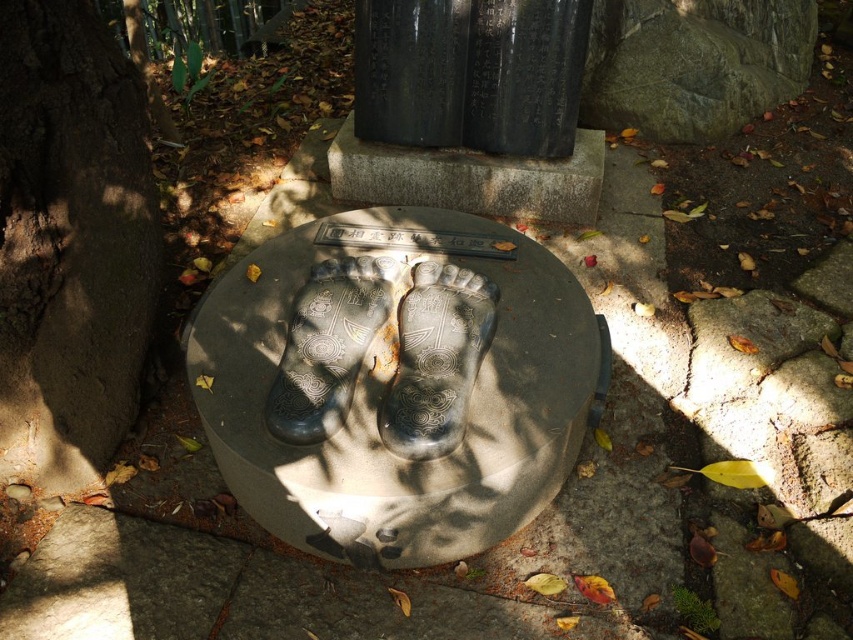
Question: Is gray stone foot at center behind black stone foot at center?

Choices:
 (A) yes
 (B) no

Answer: (B)

Question: Can you confirm if gray stone foot at center is thinner than black stone foot at center?

Choices:
 (A) no
 (B) yes

Answer: (B)

Question: Is gray stone foot at center closer to camera compared to black stone foot at center?

Choices:
 (A) no
 (B) yes

Answer: (B)

Question: Among these objects, which one is nearest to the camera?

Choices:
 (A) gray stone foot at center
 (B) black stone foot at center

Answer: (A)

Question: Which point appears farthest from the camera in this image?

Choices:
 (A) (457, 362)
 (B) (375, 305)

Answer: (B)